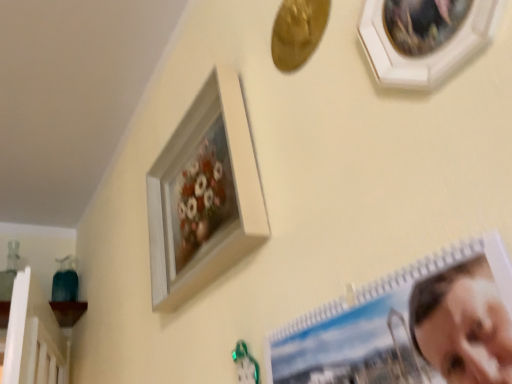
Question: In terms of width, does white matte picture frame at upper center, which ranks as the 1th picture frame in back-to-front order, look wider or thinner when compared to white wooden picture frame at upper right, which appears as the 2th picture frame when viewed from the front?

Choices:
 (A) thin
 (B) wide

Answer: (B)

Question: In the image, is white matte picture frame at upper center, which ranks as the 1th picture frame in back-to-front order, positioned in front of or behind white wooden picture frame at upper right, which appears as the 2th picture frame when viewed from the front?

Choices:
 (A) front
 (B) behind

Answer: (B)

Question: Estimate the real-world distances between objects in this image. Which object is farther from the spiral-bound photo album at lower right, arranged as the first picture frame when viewed from the front?

Choices:
 (A) white matte picture frame at upper center, the 3th picture frame in the front-to-back sequence
 (B) white wooden picture frame at upper right, the second picture frame when ordered from back to front

Answer: (A)

Question: Which object is the closest to the white matte picture frame at upper center, the 3th picture frame in the front-to-back sequence?

Choices:
 (A) spiral-bound photo album at lower right, arranged as the first picture frame when viewed from the front
 (B) white wooden picture frame at upper right, which appears as the 2th picture frame when viewed from the front

Answer: (A)